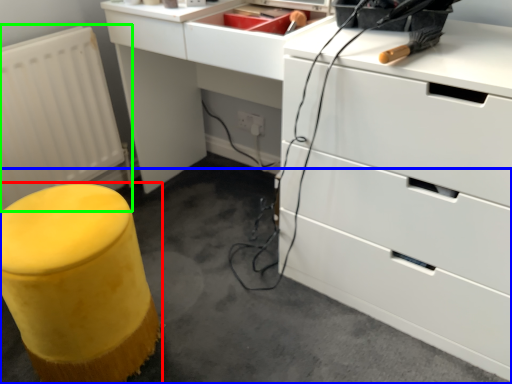
Question: Which object is the farthest from furniture (highlighted by a red box)? Choose among these: concrete (highlighted by a blue box) or radiator (highlighted by a green box).

Choices:
 (A) concrete
 (B) radiator

Answer: (B)